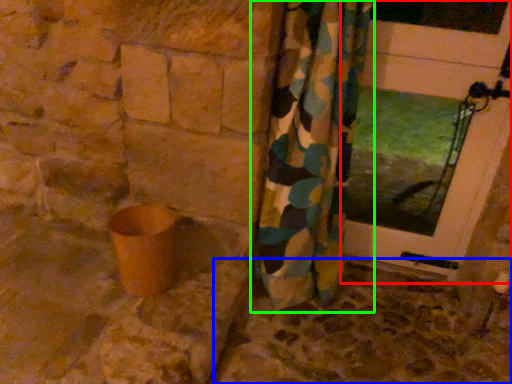
Question: Which object is the closest to the door (highlighted by a red box)? Choose among these: concrete (highlighted by a blue box) or curtain (highlighted by a green box).

Choices:
 (A) concrete
 (B) curtain

Answer: (B)